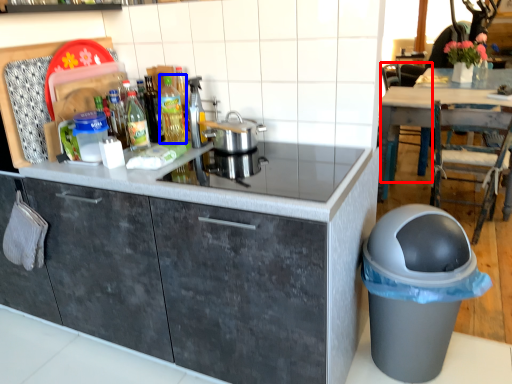
Question: Which object is closer to the camera taking this photo, chair (highlighted by a red box) or bottle (highlighted by a blue box)?

Choices:
 (A) chair
 (B) bottle

Answer: (B)